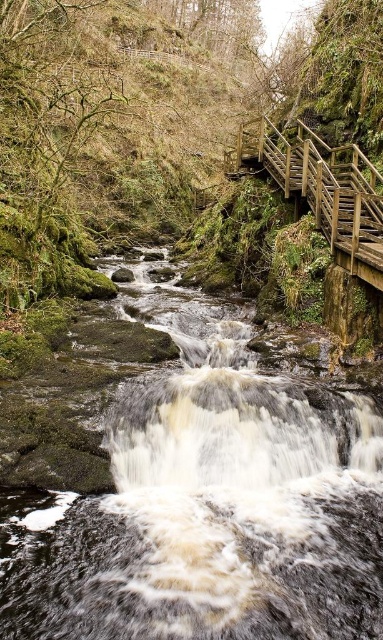
You are standing at the bottom of the wooden staircase on the right side of the image. You want to cross to the other side of the dark gray stone stream at center. Is the stream directly in front of you, or to your left or right?

The dark gray stone stream at center is located at point coordinates that place it directly in front of you relative to your position at the bottom of the wooden staircase on the right side of the image.